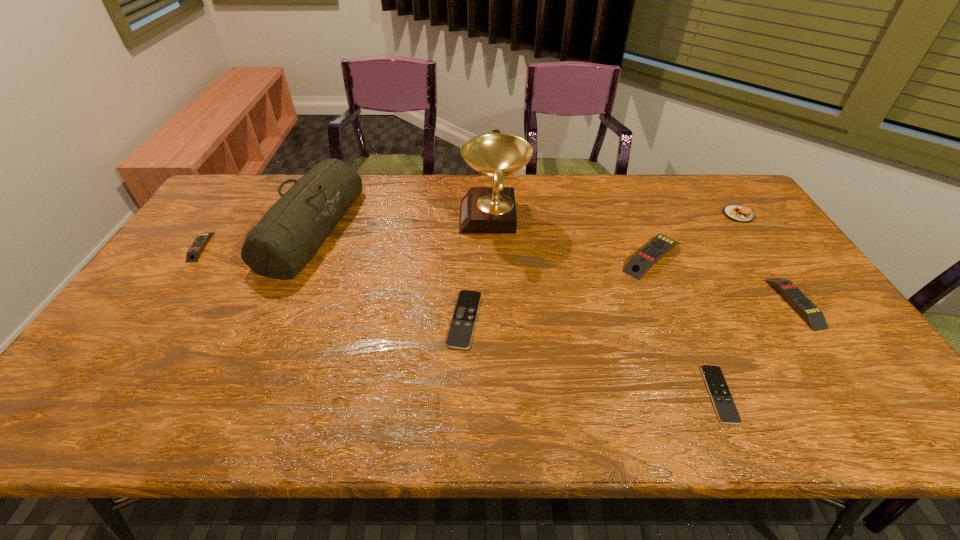
Find the location of a particular element. This screenshot has width=960, height=540. vacant area located 0.350m on the left of the second smallest yellow remote control is located at coordinates (649, 303).

You are a GUI agent. You are given a task and a screenshot of the screen. Output one action in this format:
    pyautogui.click(x=<x>, y=<y>)
    Task: Click on the vacant position located on the front of the leftmost remote control
    Image resolution: width=960 pixels, height=540 pixels.
    Given the screenshot: What is the action you would take?
    pyautogui.click(x=123, y=358)

Where is `free location located on the back of the seventh tallest object`? The height and width of the screenshot is (540, 960). free location located on the back of the seventh tallest object is located at coordinates (468, 217).

Locate an element on the screen. This screenshot has height=540, width=960. vacant position located 0.220m on the left of the right black remote control is located at coordinates (610, 394).

Locate an element on the screen. award that is positioned at the far edge is located at coordinates (484, 210).

Identify the location of duffel bag that is positioned at the far edge. (291, 232).

Identify the location of patty that is at the far edge. The height and width of the screenshot is (540, 960). (737, 213).

Locate an element on the screen. object that is positioned at the near edge is located at coordinates (726, 410).

Find the location of a particular element. The height and width of the screenshot is (540, 960). object that is at the left edge is located at coordinates (193, 254).

At what (x,y) coordinates should I click in order to perform the action: click on patty located at the right edge. Please return your answer as a coordinate pair (x, y). The height and width of the screenshot is (540, 960). Looking at the image, I should click on (737, 213).